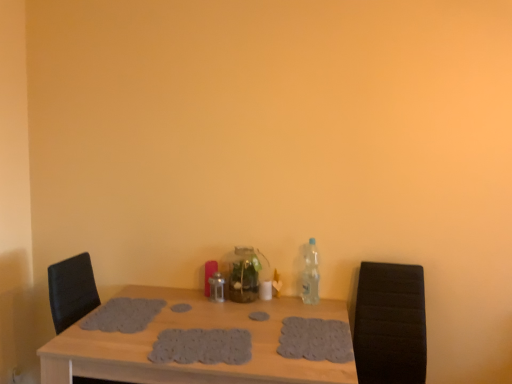
Locate an element on the screen. blank area to the left of clear plastic bottle at right, positioned as the second bottle in left-to-right order is located at coordinates tap(287, 306).